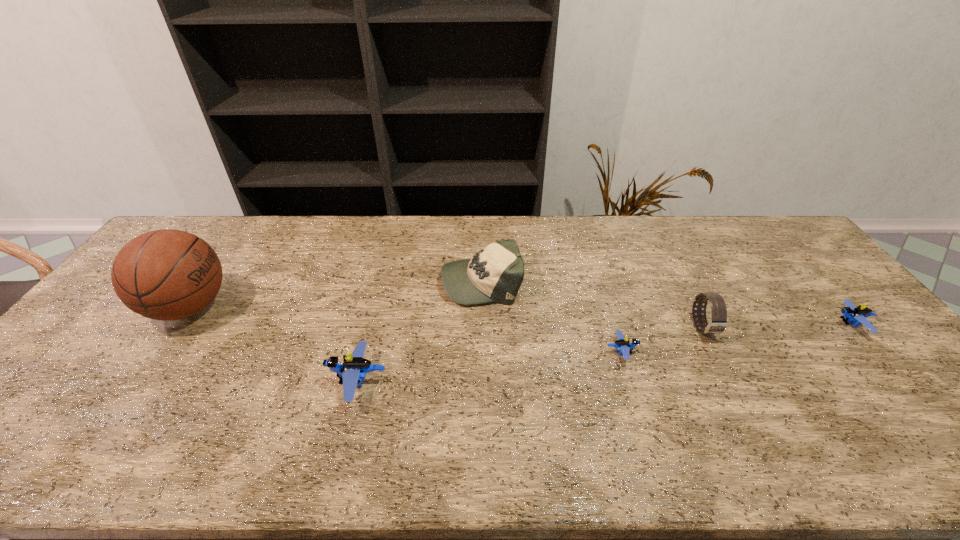
Identify the location of free space between the rightmost Lego and the baseball cap. The width and height of the screenshot is (960, 540). (667, 302).

Locate an element on the screen. The height and width of the screenshot is (540, 960). unoccupied area between the rightmost object and the second object from right to left is located at coordinates (778, 326).

Identify the location of free space between the shortest Lego and the second shortest object. (736, 338).

Find the location of a particular element. free space between the fourth object from right to left and the second shortest object is located at coordinates (667, 302).

Image resolution: width=960 pixels, height=540 pixels. Find the location of `free space between the second object from left to right and the tallest object`. free space between the second object from left to right and the tallest object is located at coordinates (274, 345).

Locate an element on the screen. The image size is (960, 540). free spot between the leftmost Lego and the fourth object from right to left is located at coordinates (420, 332).

Locate an element on the screen. Image resolution: width=960 pixels, height=540 pixels. unoccupied area between the rightmost Lego and the basketball is located at coordinates (520, 316).

Locate an element on the screen. vacant area between the shortest Lego and the fifth object from right to left is located at coordinates (490, 367).

Identify which object is located as the second nearest to the leftmost Lego. Please provide its 2D coordinates. Your answer should be formatted as a tuple, i.e. [(x, y)], where the tuple contains the x and y coordinates of a point satisfying the conditions above.

[(167, 274)]

Identify which object is located as the fourth nearest to the leftmost Lego. Please provide its 2D coordinates. Your answer should be formatted as a tuple, i.e. [(x, y)], where the tuple contains the x and y coordinates of a point satisfying the conditions above.

[(718, 322)]